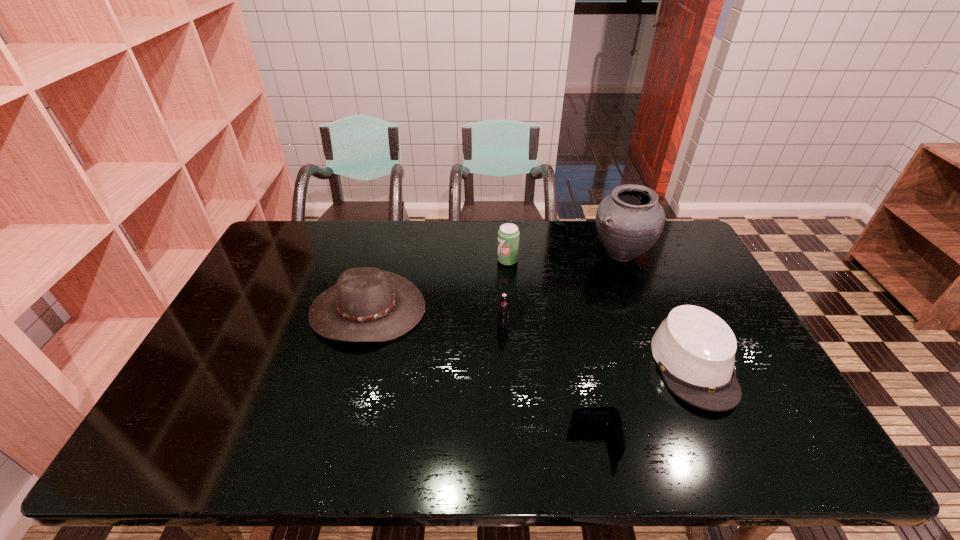
The width and height of the screenshot is (960, 540). I want to click on vacant space located 0.250m on the front label of the shorter pop, so click(x=507, y=403).

At what (x,y) coordinates should I click in order to perform the action: click on vacant space located on the outer surface of the third object from right to left. Please return your answer as a coordinate pair (x, y). The image size is (960, 540). Looking at the image, I should click on (524, 443).

Image resolution: width=960 pixels, height=540 pixels. I want to click on vacant region located 0.340m on the outer surface of the third object from right to left, so click(424, 443).

Where is `vacant position located 0.340m on the outer surface of the third object from right to left`? vacant position located 0.340m on the outer surface of the third object from right to left is located at coordinates (424, 443).

Where is `urn at the far edge`? This screenshot has height=540, width=960. urn at the far edge is located at coordinates (629, 222).

This screenshot has width=960, height=540. I want to click on soda located in the far edge section of the desktop, so click(508, 235).

Locate an element on the screen. This screenshot has height=540, width=960. object present at the near edge is located at coordinates 590,416.

Where is `urn that is at the right edge`? Image resolution: width=960 pixels, height=540 pixels. urn that is at the right edge is located at coordinates (629, 222).

The width and height of the screenshot is (960, 540). In order to click on hat that is positioned at the right edge in this screenshot , I will do `click(694, 349)`.

Locate an element on the screen. object at the far right corner is located at coordinates (629, 222).